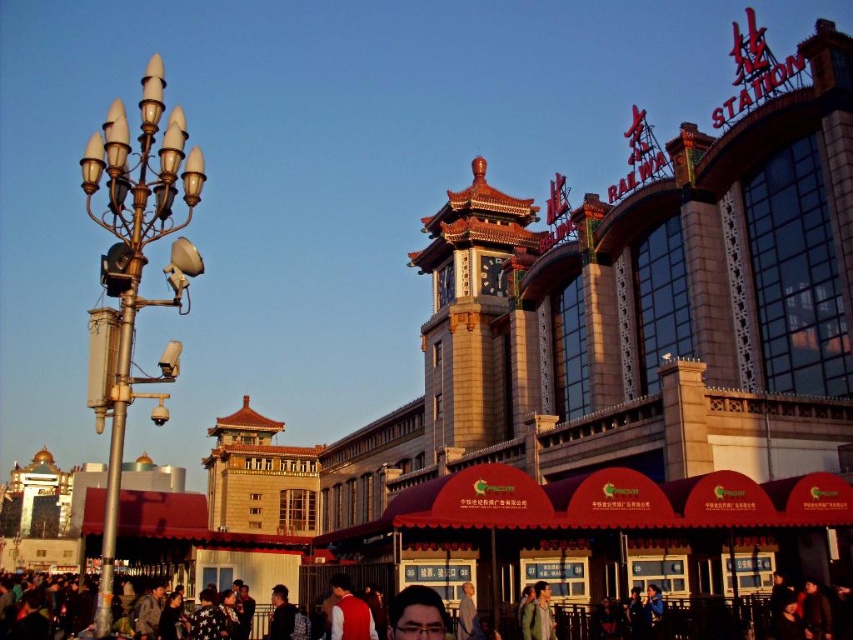
Question: Which point is closer to the camera taking this photo?

Choices:
 (A) (154, 128)
 (B) (747, 608)

Answer: (A)

Question: Which point appears closest to the camera in this image?

Choices:
 (A) (115, 296)
 (B) (846, 611)

Answer: (A)

Question: Can you confirm if gold metallic streetlight at left is bigger than dark gray clothing at lower center?

Choices:
 (A) no
 (B) yes

Answer: (B)

Question: Does gold metallic streetlight at left come in front of dark gray clothing at lower center?

Choices:
 (A) yes
 (B) no

Answer: (A)

Question: Can you confirm if gold metallic streetlight at left is smaller than dark gray clothing at lower center?

Choices:
 (A) yes
 (B) no

Answer: (B)